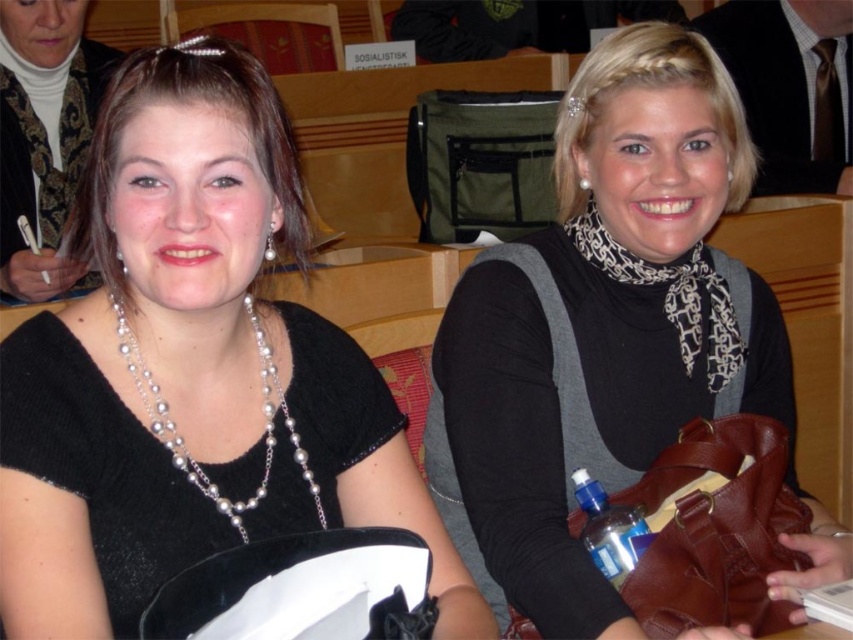
You are standing at the point labeled point (39, 148). You want to reach a door that is 2 meters away from you. Is the door within your reach?

The distance between the point (39, 148) and the viewer is 1.84 meters, so the door is within reach since it is only 2 meters away from the point.

You are standing 5 feet away from the camera. Is the point at coordinates point (30, 132) closer to you than the camera?

The distance of point (30, 132) from the camera is 6.02 feet. Since you are standing 5 feet away from the camera, the point is farther away from you than the camera is.